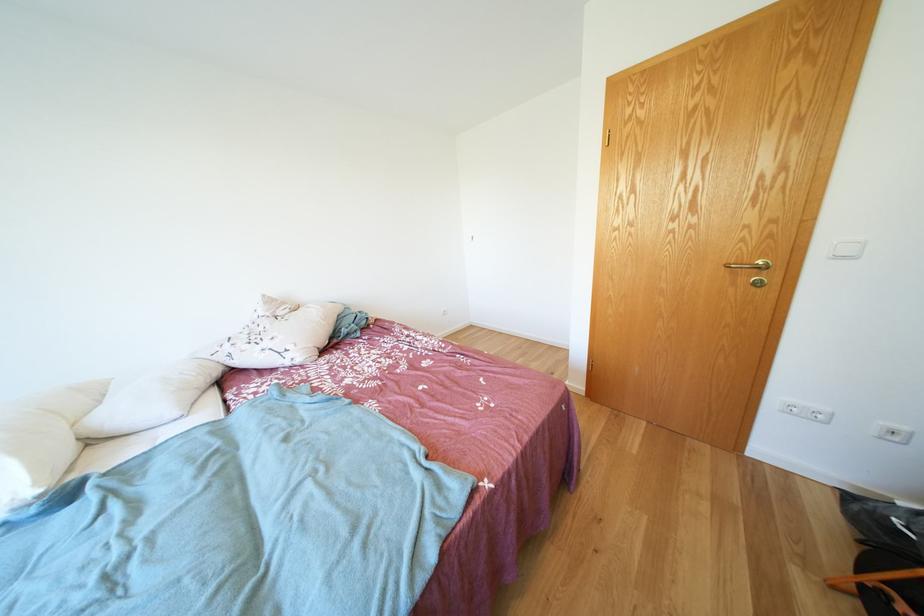
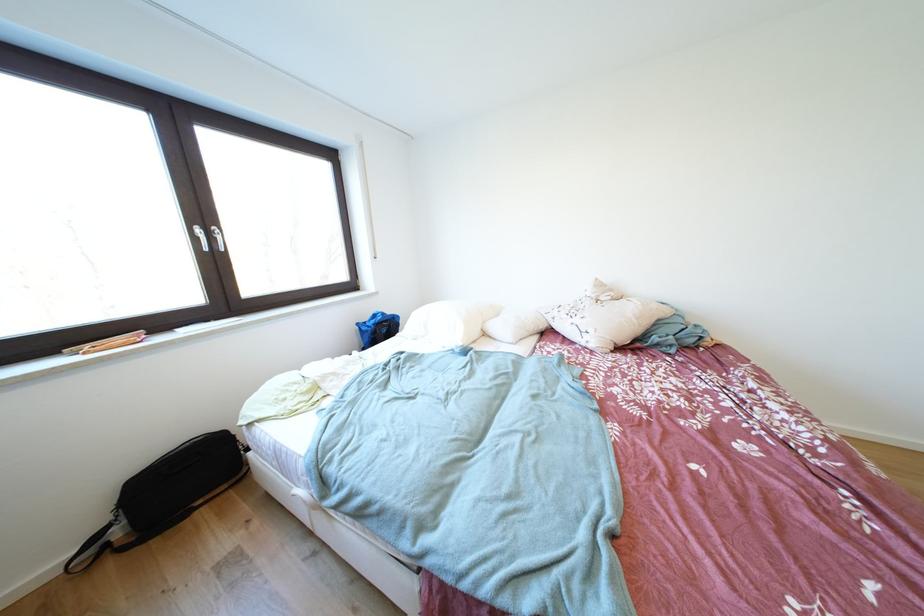
Locate, in the second image, the point that corresponds to the point at 273,300 in the first image.

(604, 284)